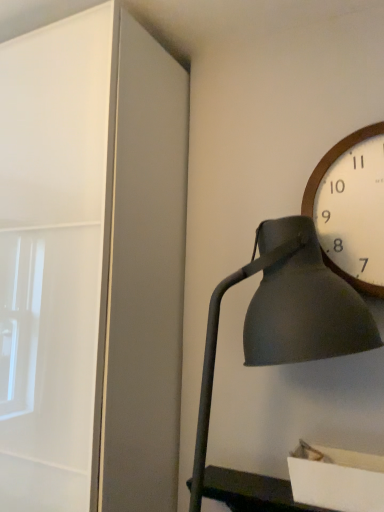
Question: Is matte black lamp at right taller than wooden/textured wall clock at upper right?

Choices:
 (A) no
 (B) yes

Answer: (B)

Question: From the image's perspective, is matte black lamp at right over wooden/textured wall clock at upper right?

Choices:
 (A) yes
 (B) no

Answer: (B)

Question: Is wooden/textured wall clock at upper right completely or partially inside matte black lamp at right?

Choices:
 (A) no
 (B) yes

Answer: (B)

Question: Does matte black lamp at right lie in front of wooden/textured wall clock at upper right?

Choices:
 (A) yes
 (B) no

Answer: (A)

Question: Could you tell me if matte black lamp at right is facing wooden/textured wall clock at upper right?

Choices:
 (A) no
 (B) yes

Answer: (A)

Question: Is matte black lamp at right to the right of wooden/textured wall clock at upper right from the viewer's perspective?

Choices:
 (A) yes
 (B) no

Answer: (B)

Question: Does wooden/textured wall clock at upper right lie in front of matte black lamp at right?

Choices:
 (A) no
 (B) yes

Answer: (A)

Question: Does wooden/textured wall clock at upper right have a smaller size compared to matte black lamp at right?

Choices:
 (A) no
 (B) yes

Answer: (B)

Question: From the image's perspective, is wooden/textured wall clock at upper right under matte black lamp at right?

Choices:
 (A) no
 (B) yes

Answer: (A)

Question: Does wooden/textured wall clock at upper right have a lesser height compared to matte black lamp at right?

Choices:
 (A) yes
 (B) no

Answer: (A)

Question: Is wooden/textured wall clock at upper right bigger than matte black lamp at right?

Choices:
 (A) yes
 (B) no

Answer: (B)

Question: Is wooden/textured wall clock at upper right oriented away from matte black lamp at right?

Choices:
 (A) yes
 (B) no

Answer: (B)

Question: Looking at their shapes, would you say wooden/textured wall clock at upper right is wider or thinner than matte black lamp at right?

Choices:
 (A) thin
 (B) wide

Answer: (A)